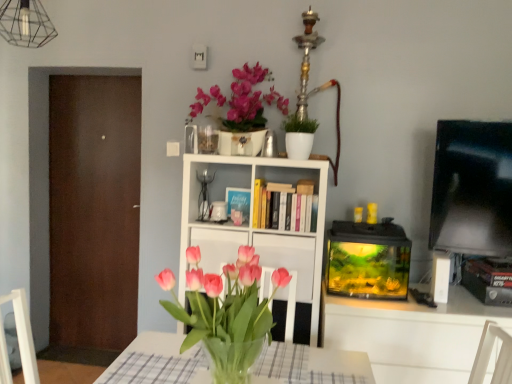
Question: Do you think white glossy cabinet at center is within white matte bookcase at center, or outside of it?

Choices:
 (A) inside
 (B) outside

Answer: (A)

Question: From the image's perspective, relative to white matte bookcase at center, is white glossy cabinet at center above or below?

Choices:
 (A) above
 (B) below

Answer: (B)

Question: Which is farther from the pink glass vase at center?

Choices:
 (A) matte ceramic vase at upper center
 (B) white matte bookcase at center
 (C) white glossy cabinet at center
 (D) white glossy mug at center
 (E) brown matte door at left

Answer: (E)

Question: Which object is the farthest from the pink glass vase at center?

Choices:
 (A) brown matte door at left
 (B) white glossy mug at center
 (C) matte ceramic vase at upper center
 (D) white matte bookcase at center
 (E) white glossy cabinet at center

Answer: (A)